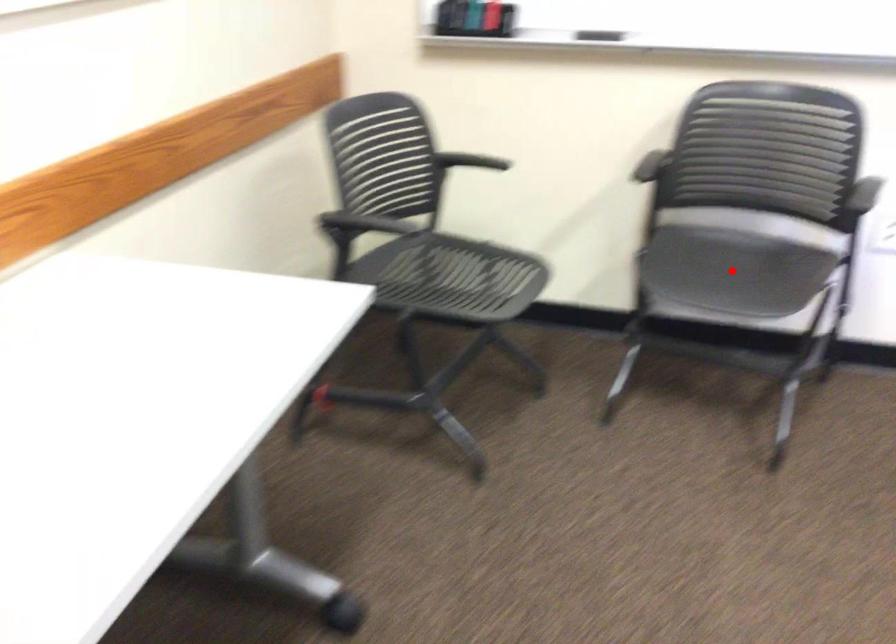
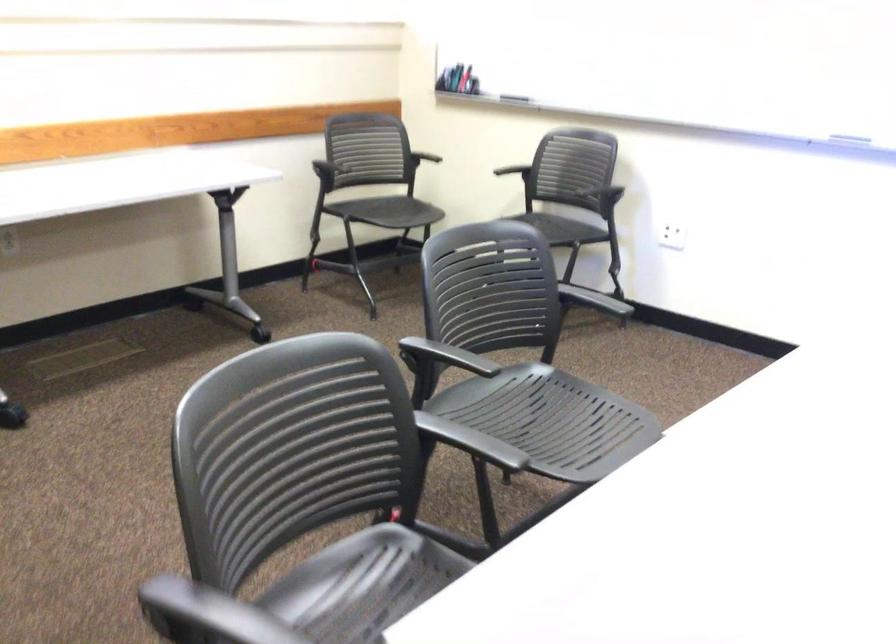
Question: I am providing you with two images of the same scene from different viewpoints. A red point is marked on the first image. Can you still see the location of the red point in image 2?

Choices:
 (A) Yes
 (B) No

Answer: (B)